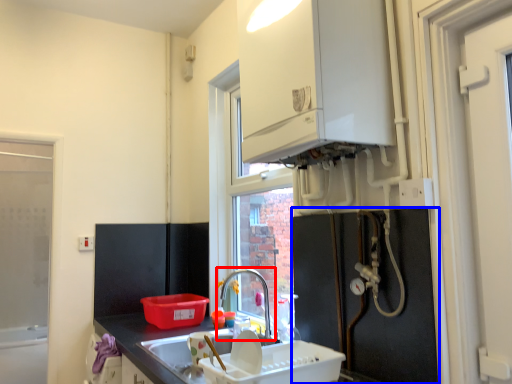
Question: Which object appears closest to the camera in this image, tap (highlighted by a red box) or appliance (highlighted by a blue box)?

Choices:
 (A) tap
 (B) appliance

Answer: (B)